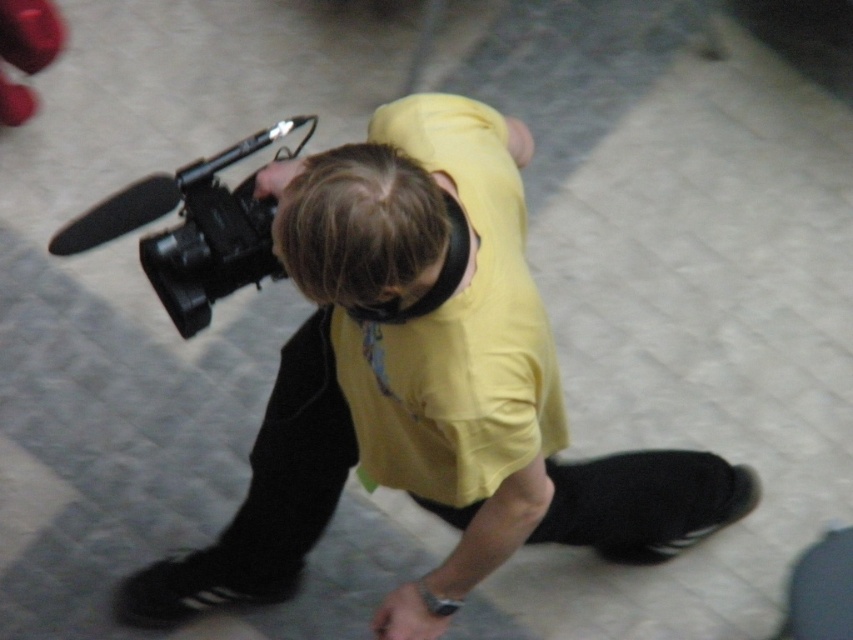
You are standing in a room and see a point marked at coordinates [569,484]. If you want to place a 3 feet wide poster on the wall behind the person, will there be enough space between the point and the wall?

The point at [569,484] is 9.20 feet from the viewer. Since the poster is 3 feet wide, there is sufficient space between the point and the wall as the distance is greater than the poster width.

You are a photographer who needs to place both the black matte camera at center and the black matte video camera at center on a shelf. The shelf has a width of 35 centimeters. Can both items fit side by side on the shelf without overlapping?

The black matte camera at center and black matte video camera at center are 34.79 centimeters apart, so they can fit side by side on a 35 centimeter shelf since the total width required is less than the shelf width.

You are setting up equipment for a live stream and have two cameras in front of you. You need to place the taller one on a higher shelf. Which one should you choose between the black matte camera at center and the black matte video camera at center?

The black matte camera at center is taller than the black matte video camera at center, so you should choose the black matte camera at center to place on the higher shelf.